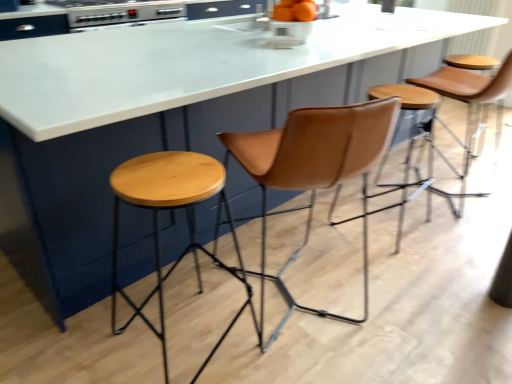
This screenshot has width=512, height=384. What are the coordinates of `vacant space that's between brown leather swivel chair at center and leather stool at center, the second stool from the front` in the screenshot? It's located at (351, 251).